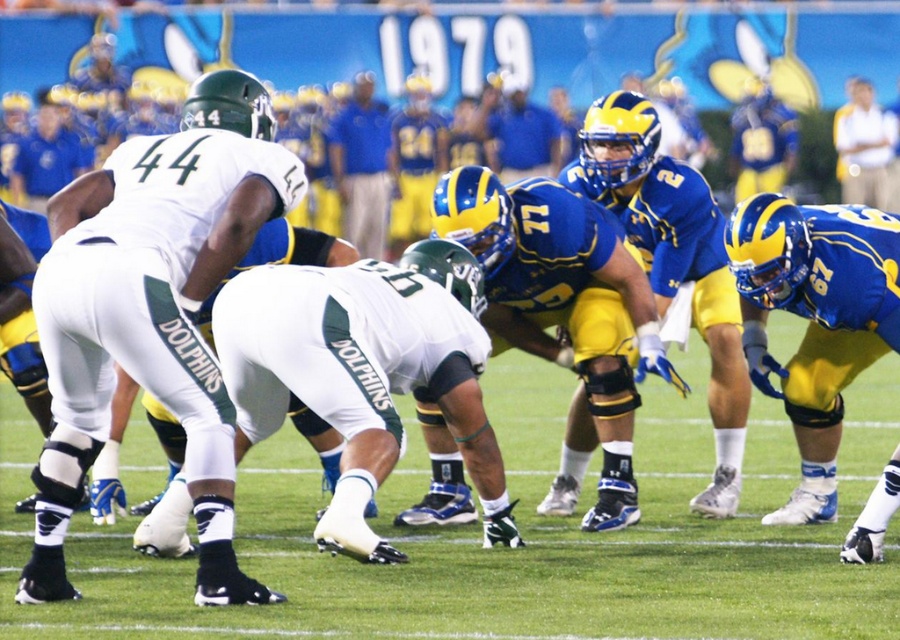
You are a sports analyst watching the game. You notice two players at the center of the field, the white matte uniform at center and the blue jersey at center. Which player takes up more space in the image?

The white matte uniform at center takes up more space in the image because its width is larger than that of the blue jersey at center.